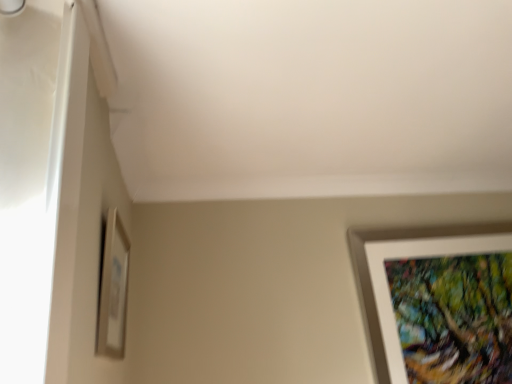
Question: Is the depth of white matte picture frame at lower right, which ranks as the 1th picture frame in back-to-front order, greater than that of matte white picture frame at lower left, which appears as the second picture frame when viewed from the right?

Choices:
 (A) no
 (B) yes

Answer: (B)

Question: From a real-world perspective, is white matte picture frame at lower right, which ranks as the 1th picture frame in back-to-front order, on matte white picture frame at lower left, which appears as the second picture frame when viewed from the right?

Choices:
 (A) no
 (B) yes

Answer: (A)

Question: Could you tell me if white matte picture frame at lower right, which ranks as the 1th picture frame in back-to-front order, is facing matte white picture frame at lower left, which is the first picture frame in left-to-right order?

Choices:
 (A) no
 (B) yes

Answer: (A)

Question: Does white matte picture frame at lower right, which ranks as the 1th picture frame in back-to-front order, have a smaller size compared to matte white picture frame at lower left, which ranks as the 2th picture frame in back-to-front order?

Choices:
 (A) no
 (B) yes

Answer: (A)

Question: Can you confirm if white matte picture frame at lower right, acting as the 2th picture frame starting from the front, is taller than matte white picture frame at lower left, the first picture frame positioned from the front?

Choices:
 (A) yes
 (B) no

Answer: (A)

Question: From a real-world perspective, is white matte picture frame at lower right, the 1th picture frame when ordered from right to left, below matte white picture frame at lower left, the first picture frame positioned from the front?

Choices:
 (A) yes
 (B) no

Answer: (A)

Question: Does matte white picture frame at lower left, the first picture frame positioned from the front, have a greater height compared to white matte picture frame at lower right, which is counted as the second picture frame, starting from the left?

Choices:
 (A) yes
 (B) no

Answer: (B)

Question: Are matte white picture frame at lower left, which is the first picture frame in left-to-right order, and white matte picture frame at lower right, the 1th picture frame when ordered from right to left, far apart?

Choices:
 (A) yes
 (B) no

Answer: (A)

Question: Is matte white picture frame at lower left, which is the first picture frame in left-to-right order, wider than white matte picture frame at lower right, which is counted as the second picture frame, starting from the left?

Choices:
 (A) yes
 (B) no

Answer: (B)

Question: Can you confirm if matte white picture frame at lower left, which ranks as the 2th picture frame in back-to-front order, is bigger than white matte picture frame at lower right, acting as the 2th picture frame starting from the front?

Choices:
 (A) yes
 (B) no

Answer: (B)

Question: Can you confirm if matte white picture frame at lower left, the first picture frame positioned from the front, is positioned to the left of white matte picture frame at lower right, acting as the 2th picture frame starting from the front?

Choices:
 (A) no
 (B) yes

Answer: (B)

Question: From a real-world perspective, is matte white picture frame at lower left, which appears as the second picture frame when viewed from the right, located beneath white matte picture frame at lower right, which is counted as the second picture frame, starting from the left?

Choices:
 (A) no
 (B) yes

Answer: (A)

Question: Do you think matte white picture frame at lower left, the first picture frame positioned from the front, is within white matte picture frame at lower right, acting as the 2th picture frame starting from the front, or outside of it?

Choices:
 (A) outside
 (B) inside

Answer: (A)